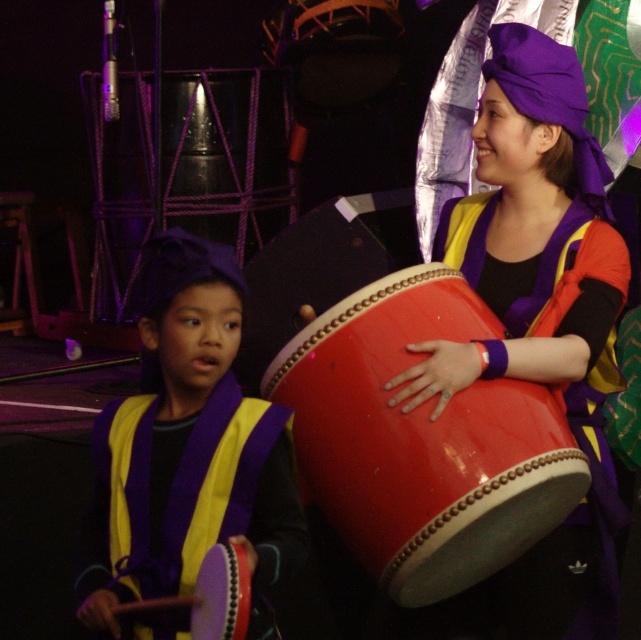
Does shiny red drum at center have a larger size compared to purple matte drumstick at left?

Yes.

Is shiny red drum at center wider than purple matte drumstick at left?

Yes, shiny red drum at center is wider than purple matte drumstick at left.

Is point (454, 531) behind point (151, 563)?

Yes, point (454, 531) is farther from viewer.

The height and width of the screenshot is (640, 641). Identify the location of shiny red drum at center. (422, 440).

Can you confirm if shiny purple drum at center is positioned below purple matte drumstick at left?

Incorrect, shiny purple drum at center is not positioned below purple matte drumstick at left.

Can you confirm if shiny purple drum at center is positioned above purple matte drumstick at left?

Yes, shiny purple drum at center is above purple matte drumstick at left.

Describe the element at coordinates (540, 301) in the screenshot. The height and width of the screenshot is (640, 641). I see `shiny purple drum at center` at that location.

Where is `shiny purple drum at center`? Image resolution: width=641 pixels, height=640 pixels. shiny purple drum at center is located at coordinates (540, 301).

Does shiny purple drum at center appear on the right side of shiny red drum at center?

Yes, shiny purple drum at center is to the right of shiny red drum at center.

Can you confirm if shiny purple drum at center is taller than shiny red drum at center?

Indeed, shiny purple drum at center has a greater height compared to shiny red drum at center.

Find the location of a particular element. The image size is (641, 640). shiny purple drum at center is located at coordinates (540, 301).